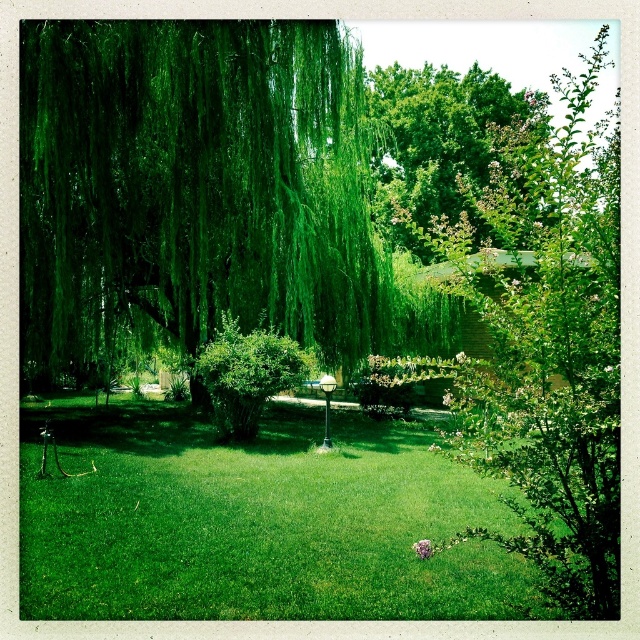
Looking at this image, you are standing in the garden and want to place a small decorative statue exactly at the point marked by the coordinates point (253,518). According to the scene description, where should you place the statue?

You should place the statue at the green grass at center, as it is located at point (253,518).

You are standing in the garden and notice two points marked in the scene. The first point is at coordinate point (202, 515) and the second is at coordinate point (259, 339). Which point is closer to you?

Point (202, 515) is closer to the viewer than point (259, 339).

You are standing in the garden and want to take a photo of the green grass at center and the green leafy tree at upper center. Which object will appear larger in your photo?

The green grass at center will appear larger in the photo because it is closer to the viewer than the green leafy tree at upper center.